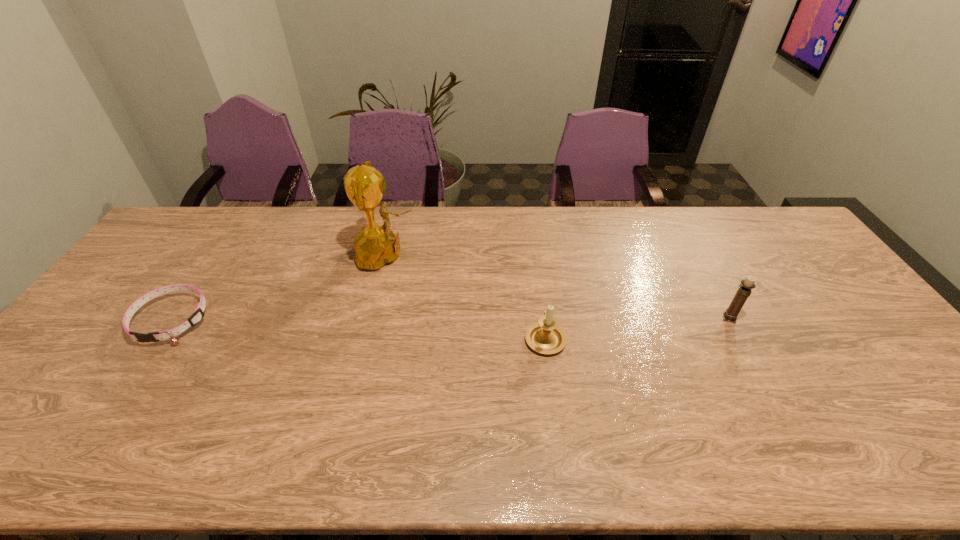
The image size is (960, 540). Identify the location of free point between the tallest object and the dog collar. 279,287.

Identify the location of empty space between the shorter candle holder and the rightmost object. The width and height of the screenshot is (960, 540). (637, 328).

The width and height of the screenshot is (960, 540). What are the coordinates of `vacant area between the right candle holder and the shorter candle holder` in the screenshot? It's located at (637, 328).

I want to click on empty space between the third object from left to right and the right candle holder, so click(x=637, y=328).

The width and height of the screenshot is (960, 540). Identify the location of free space between the farthest object and the left candle holder. (466, 296).

Locate an element on the screen. vacant area that lies between the shortest object and the farthest object is located at coordinates (279, 287).

Image resolution: width=960 pixels, height=540 pixels. Find the location of `vacant area that lies between the left candle holder and the rightmost object`. vacant area that lies between the left candle holder and the rightmost object is located at coordinates (637, 328).

Image resolution: width=960 pixels, height=540 pixels. Find the location of `free spot between the left candle holder and the shortest object`. free spot between the left candle holder and the shortest object is located at coordinates (359, 329).

This screenshot has height=540, width=960. Identify the location of vacant point located between the third object from left to right and the rightmost object. (637, 328).

Locate an element on the screen. vacant area that lies between the award and the rightmost object is located at coordinates (558, 286).